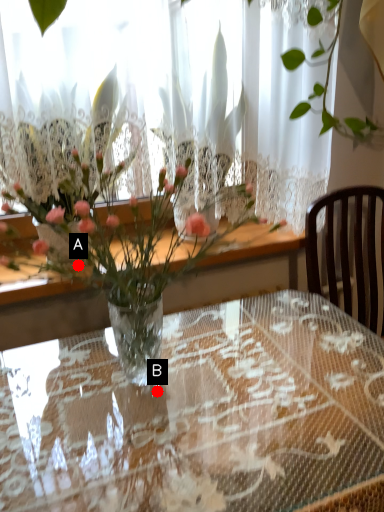
Question: Two points are circled on the image, labeled by A and B beside each circle. Among these points, which one is farthest from the camera?

Choices:
 (A) A is further
 (B) B is further

Answer: (B)